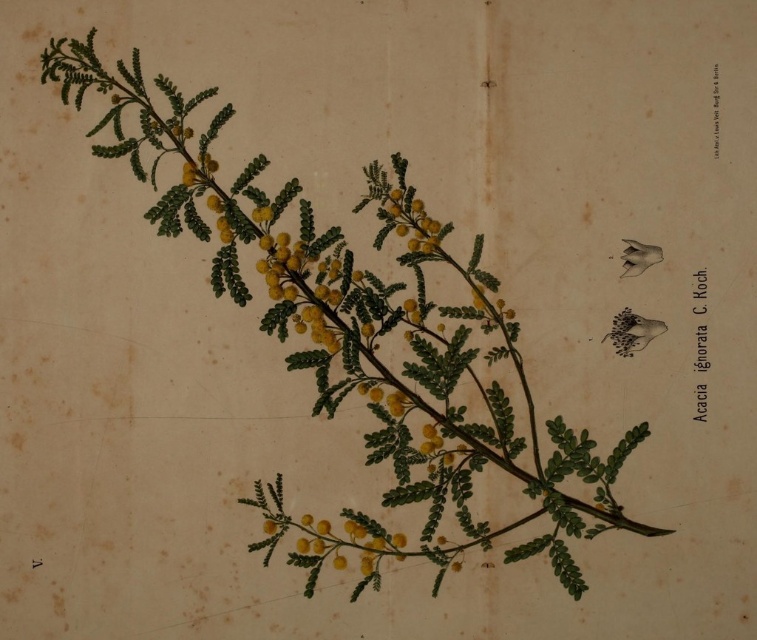
Between smooth yellow flower at center and yellow matte flower at upper right, which one appears on the left side from the viewer's perspective?

From the viewer's perspective, smooth yellow flower at center appears more on the left side.

Is smooth yellow flower at center closer to camera compared to yellow matte flower at upper right?

No, it is behind yellow matte flower at upper right.

Does point (628, 330) come farther from viewer compared to point (653, 250)?

Yes, point (628, 330) is behind point (653, 250).

The image size is (757, 640). Identify the location of smooth yellow flower at center. (631, 332).